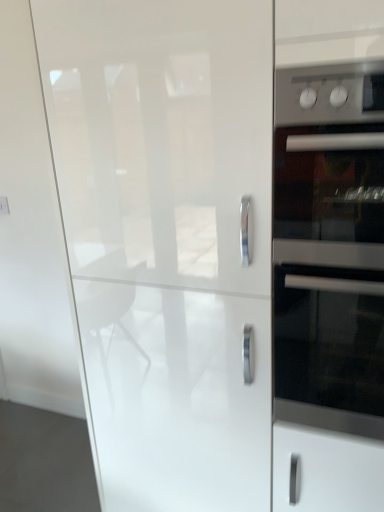
Question: In terms of height, does satin silver oven at right look taller or shorter compared to stainless steel oven at right?

Choices:
 (A) short
 (B) tall

Answer: (A)

Question: From a real-world perspective, is satin silver oven at right above or below stainless steel oven at right?

Choices:
 (A) above
 (B) below

Answer: (A)

Question: Based on their relative distances, which object is farther from the satin silver oven at right?

Choices:
 (A) stainless steel oven at right
 (B) glossy white cabinet at center

Answer: (B)

Question: Estimate the real-world distances between objects in this image. Which object is closer to the satin silver oven at right?

Choices:
 (A) stainless steel oven at right
 (B) glossy white cabinet at center

Answer: (A)